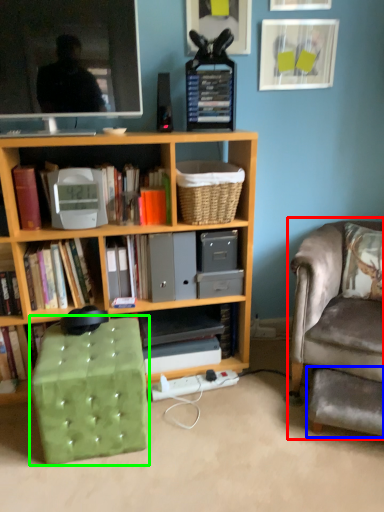
Question: Considering the real-world distances, which object is farthest from chair (highlighted by a red box)? footrest (highlighted by a blue box) or music stool (highlighted by a green box)?

Choices:
 (A) footrest
 (B) music stool

Answer: (B)